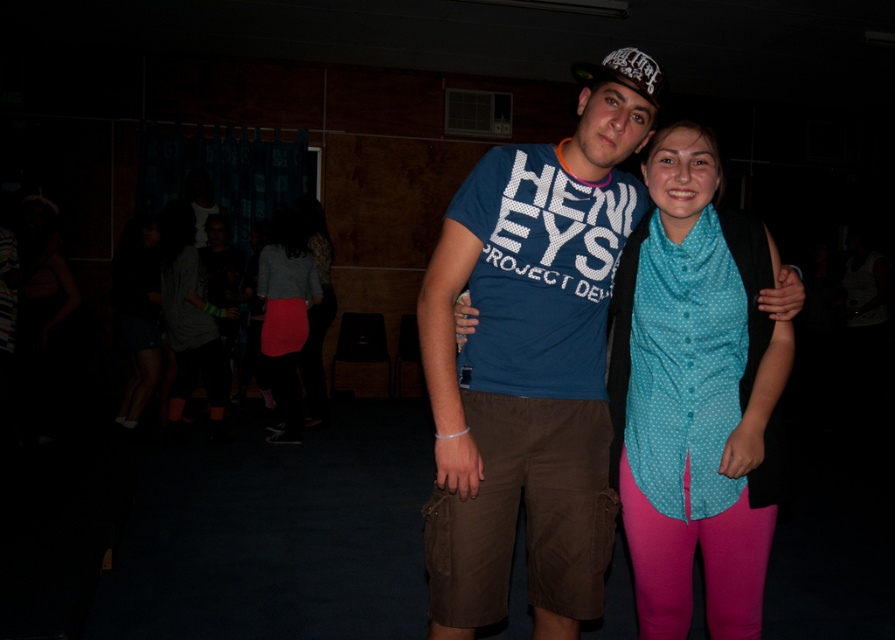
Question: Can you confirm if blue t-shirt at center is positioned above teal polka dot blouse at center?

Choices:
 (A) no
 (B) yes

Answer: (B)

Question: Is teal polka dot blouse at center behind matte pink skirt at lower left?

Choices:
 (A) yes
 (B) no

Answer: (B)

Question: Among these points, which one is nearest to the camera?

Choices:
 (A) (570, 564)
 (B) (657, 440)
 (C) (195, 252)

Answer: (A)

Question: Considering the real-world distances, which object is closest to the matte pink skirt at center?

Choices:
 (A) teal polka dot blouse at center
 (B) matte pink skirt at lower left
 (C) blue t-shirt at center

Answer: (B)

Question: Among these objects, which one is nearest to the camera?

Choices:
 (A) blue t-shirt at center
 (B) matte pink skirt at lower left
 (C) teal polka dot blouse at center

Answer: (A)

Question: In this image, where is teal polka dot blouse at center located relative to matte pink skirt at center?

Choices:
 (A) below
 (B) above

Answer: (A)